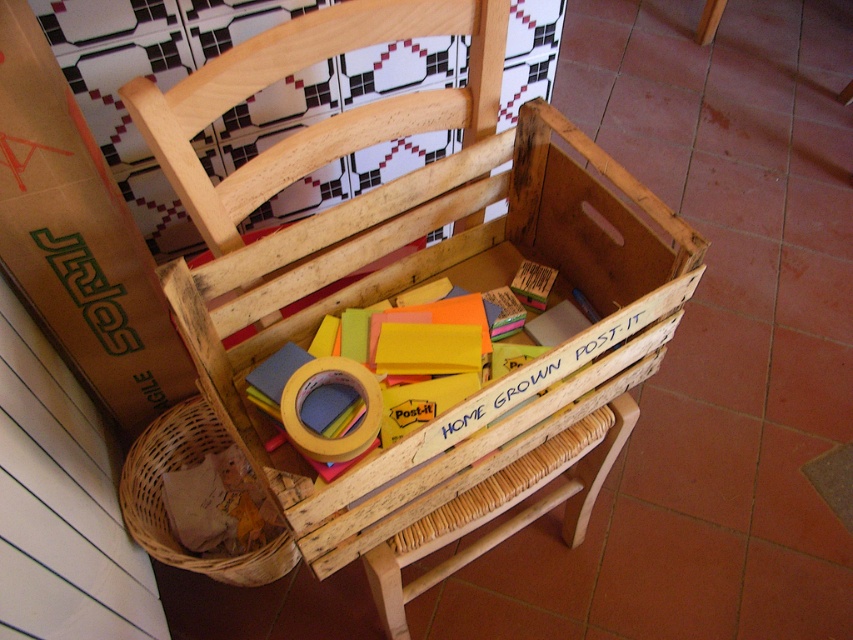
Question: Which point is farther from the camera taking this photo?

Choices:
 (A) (172, 556)
 (B) (604, 376)

Answer: (A)

Question: Does wooden crate at center appear over woven brown basket at lower left?

Choices:
 (A) yes
 (B) no

Answer: (A)

Question: Does wooden crate at center have a smaller size compared to woven brown basket at lower left?

Choices:
 (A) no
 (B) yes

Answer: (A)

Question: From the image, what is the correct spatial relationship of wooden crate at center in relation to woven brown basket at lower left?

Choices:
 (A) right
 (B) left

Answer: (A)